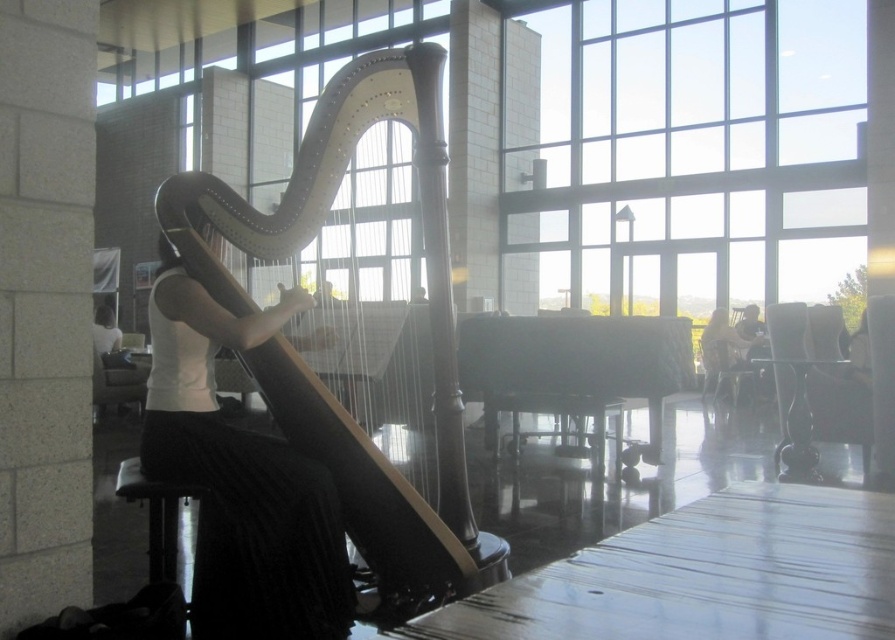
Does point (252, 316) come farther from viewer compared to point (727, 316)?

No, (252, 316) is closer to viewer.

Is matte black harpist at center to the left of matte white dress at center from the viewer's perspective?

Indeed, matte black harpist at center is positioned on the left side of matte white dress at center.

Is point (212, 419) positioned behind point (714, 321)?

No.

Image resolution: width=895 pixels, height=640 pixels. Identify the location of matte black harpist at center. (240, 477).

Is transparent glass window at upper center to the right of matte black harpist at center from the viewer's perspective?

Indeed, transparent glass window at upper center is positioned on the right side of matte black harpist at center.

Image resolution: width=895 pixels, height=640 pixels. Describe the element at coordinates (695, 150) in the screenshot. I see `transparent glass window at upper center` at that location.

This screenshot has height=640, width=895. What are the coordinates of `transparent glass window at upper center` in the screenshot? It's located at (695, 150).

Identify the location of transparent glass window at upper center. (695, 150).

Is point (840, 90) positioned behind point (354, 145)?

Yes, it is.

Which is in front, point (755, 76) or point (408, 497)?

Positioned in front is point (408, 497).

Describe the element at coordinates (695, 150) in the screenshot. I see `transparent glass window at upper center` at that location.

This screenshot has height=640, width=895. What are the coordinates of `transparent glass window at upper center` in the screenshot? It's located at (695, 150).